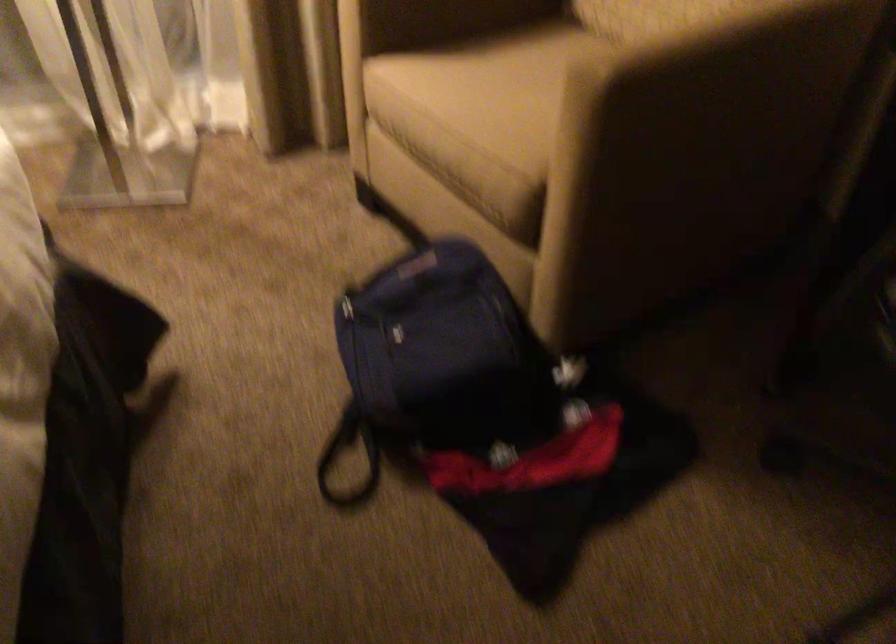
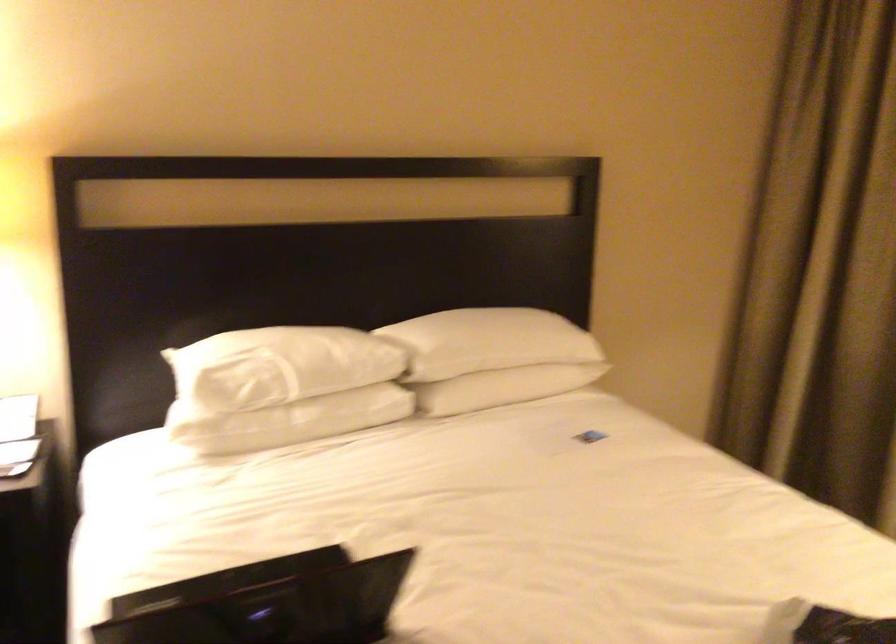
Question: The images are taken continuously from a first-person perspective. In which direction is your viewpoint rotating?

Choices:
 (A) Left
 (B) Right
 (C) Up
 (D) Down

Answer: (A)